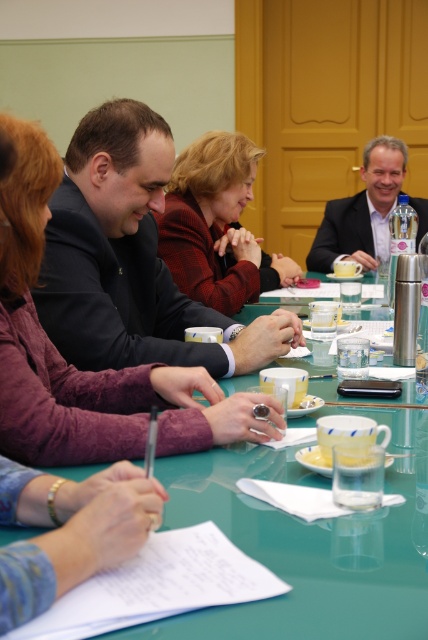
Between green glass table at center and red woolen sweater at center, which one has less height?

green glass table at center

Is point (312, 576) behind point (169, 252)?

No, it is not.

I want to click on green glass table at center, so click(309, 541).

Who is higher up, green glass table at center or black suit at center?

Positioned higher is black suit at center.

Can you confirm if green glass table at center is positioned to the left of black suit at center?

In fact, green glass table at center is to the right of black suit at center.

Where is `green glass table at center`? The image size is (428, 640). green glass table at center is located at coordinates (309, 541).

Is point (101, 177) behind point (223, 193)?

No, it is in front of (223, 193).

Can you confirm if black suit at center is shorter than red woolen sweater at center?

In fact, black suit at center may be taller than red woolen sweater at center.

Between point (104, 125) and point (189, 211), which one is positioned behind?

The point (189, 211) is behind.

In order to click on black suit at center in this screenshot , I will do `click(130, 259)`.